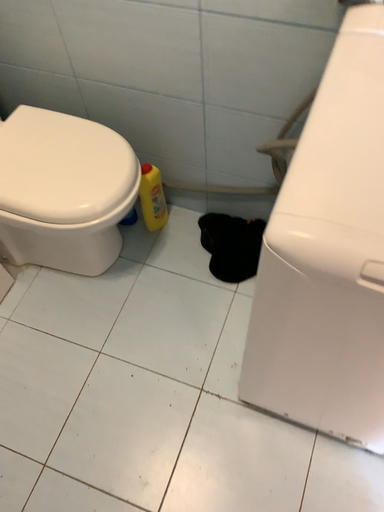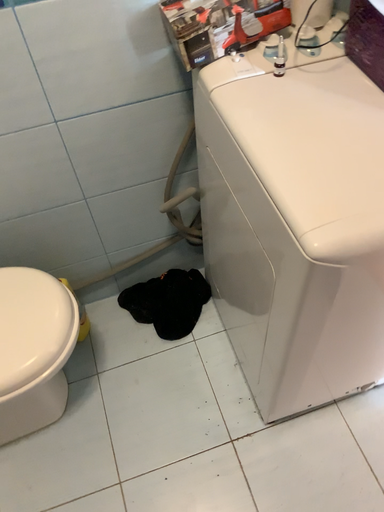
Question: How did the camera likely rotate when shooting the video?

Choices:
 (A) rotated downward
 (B) rotated upward

Answer: (B)